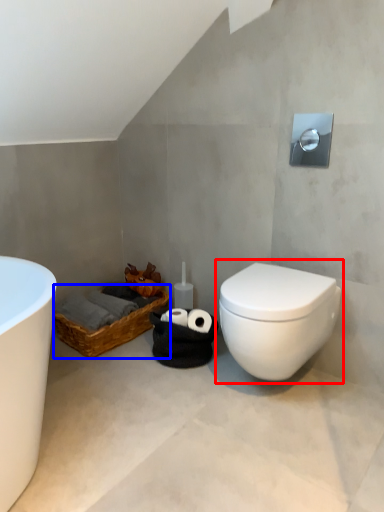
Question: Which point is further to the camera, toilet (highlighted by a red box) or basket (highlighted by a blue box)?

Choices:
 (A) toilet
 (B) basket

Answer: (B)